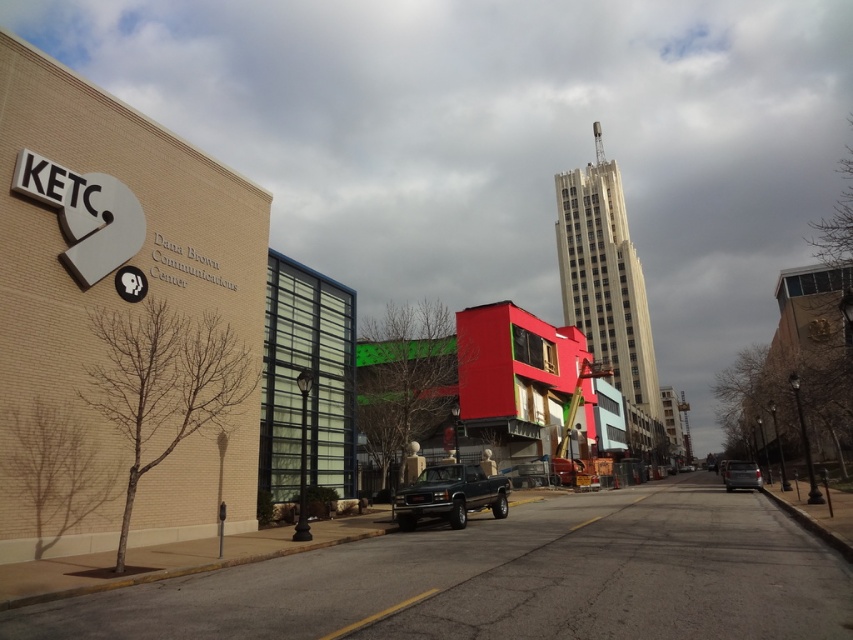
You are a delivery person trying to park your metallic gray van at center in a narrow alley between the beige brick building on the left and the tall skyscraper in the background. However, there is a matte black truck at center already parked in the spot. Based on the scene, can you determine if your van can fit in the remaining space below the truck?

The matte black truck at center is located above the metallic gray van at center, meaning there is space below the truck where the van can fit. Therefore, the metallic gray van at center can be parked in the remaining space below the truck.

You are a delivery person who needs to park your vehicle in a garage with a height restriction of 2 meters. You have two options to choose from, the matte black truck at center and the metallic gray van at center. Based on their heights, which vehicle should you choose to ensure it fits under the height restriction?

The metallic gray van at center has a lesser height compared to the matte black truck at center, so you should choose the metallic gray van at center to ensure it fits under the 2 meters height restriction.

You are a pedestrian standing on the sidewalk and see both the matte black truck at center and the metallic gray van at center. Which vehicle is nearer to you?

The matte black truck at center is closer to the viewer than the metallic gray van at center.